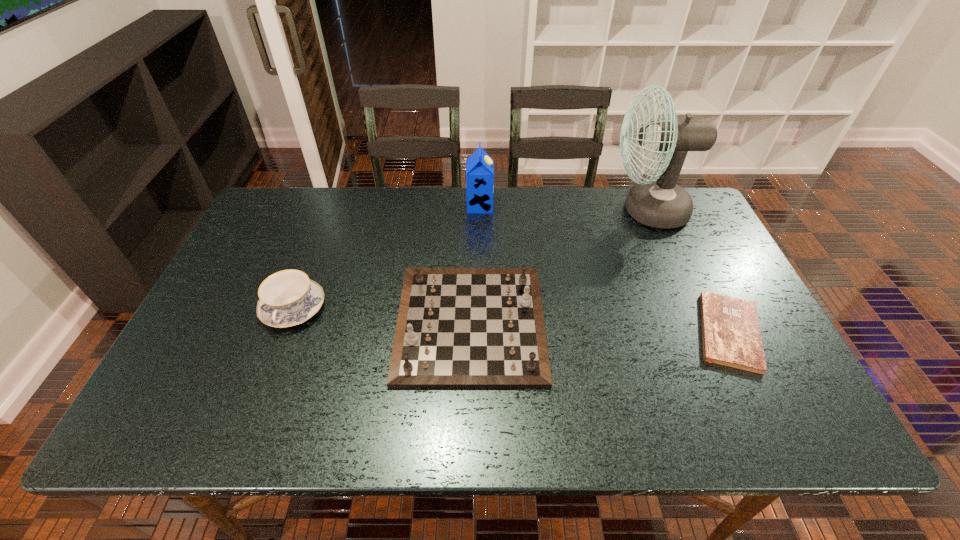
What are the coordinates of `free space that is in between the chessboard and the tallest object` in the screenshot? It's located at (559, 267).

Find the location of `free spot between the fourth shortest object and the chinaware`. free spot between the fourth shortest object and the chinaware is located at coordinates (387, 257).

What are the coordinates of `free area in between the fan and the leftmost object` in the screenshot? It's located at (470, 260).

Image resolution: width=960 pixels, height=540 pixels. I want to click on vacant point located between the tallest object and the chessboard, so click(x=559, y=267).

Locate an element on the screen. object that stands as the closest to the shortest object is located at coordinates (659, 203).

Identify which object is the third nearest to the Bible. Please provide its 2D coordinates. Your answer should be formatted as a tuple, i.e. [(x, y)], where the tuple contains the x and y coordinates of a point satisfying the conditions above.

[(479, 166)]

The image size is (960, 540). What are the coordinates of `vacant area that satisfies the following two spatial constraints: 1. in front of the Bible where the airflow is directed; 2. on the right side of the fan` in the screenshot? It's located at (699, 332).

Locate an element on the screen. The image size is (960, 540). free location that satisfies the following two spatial constraints: 1. with the cap open on the second tallest object; 2. with the handle on the side of the leftmost object is located at coordinates (480, 309).

Where is `free region that satisfies the following two spatial constraints: 1. with the cap open on the shortest object; 2. on the left side of the second tallest object`? free region that satisfies the following two spatial constraints: 1. with the cap open on the shortest object; 2. on the left side of the second tallest object is located at coordinates (480, 332).

You are a GUI agent. You are given a task and a screenshot of the screen. Output one action in this format:
    pyautogui.click(x=<x>, y=<y>)
    Task: Click on the vacant space that satisfies the following two spatial constraints: 1. with the cap open on the Bible; 2. on the left side of the second tallest object
    This screenshot has height=540, width=960.
    Given the screenshot: What is the action you would take?
    pyautogui.click(x=480, y=332)